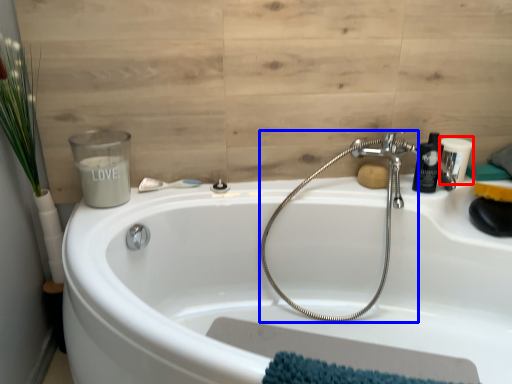
Question: Which point is further to the camera, toiletry (highlighted by a red box) or plumbing fixture (highlighted by a blue box)?

Choices:
 (A) toiletry
 (B) plumbing fixture

Answer: (A)